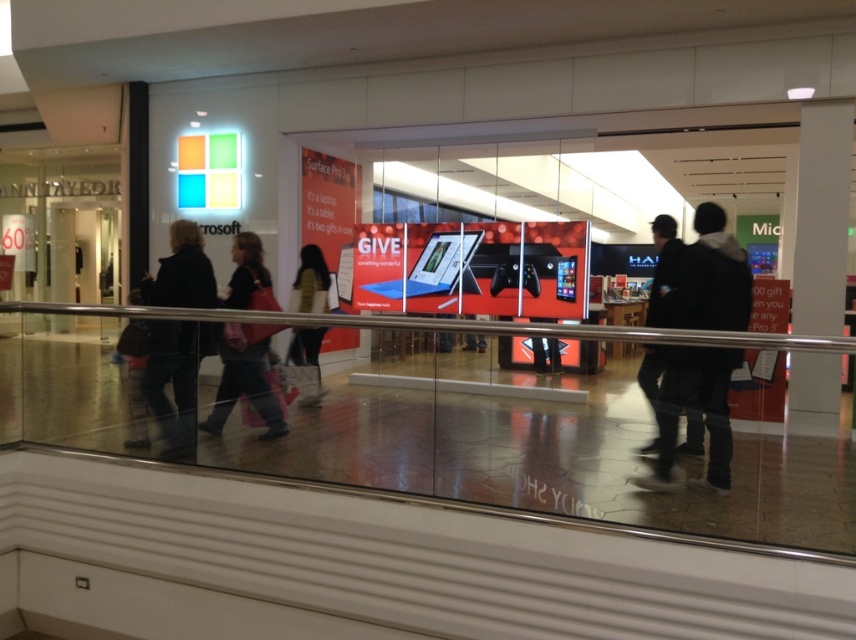
Question: Which point is closer to the camera?

Choices:
 (A) (201, 307)
 (B) (666, 248)
 (C) (682, 392)

Answer: (C)

Question: Which object is farther from the camera taking this photo?

Choices:
 (A) black fabric jacket at left
 (B) black leather jacket at center

Answer: (A)

Question: Is black fabric jacket at lower right positioned at the back of dark gray jacket at center?

Choices:
 (A) yes
 (B) no

Answer: (B)

Question: Among these objects, which one is farthest from the camera?

Choices:
 (A) dark gray jacket at center
 (B) black fabric jacket at lower right
 (C) matte black jacket at center

Answer: (A)

Question: Does black leather jacket at center come behind dark gray jacket at center?

Choices:
 (A) no
 (B) yes

Answer: (A)

Question: Does matte black jacket at center appear on the right side of dark gray jacket at center?

Choices:
 (A) no
 (B) yes

Answer: (A)